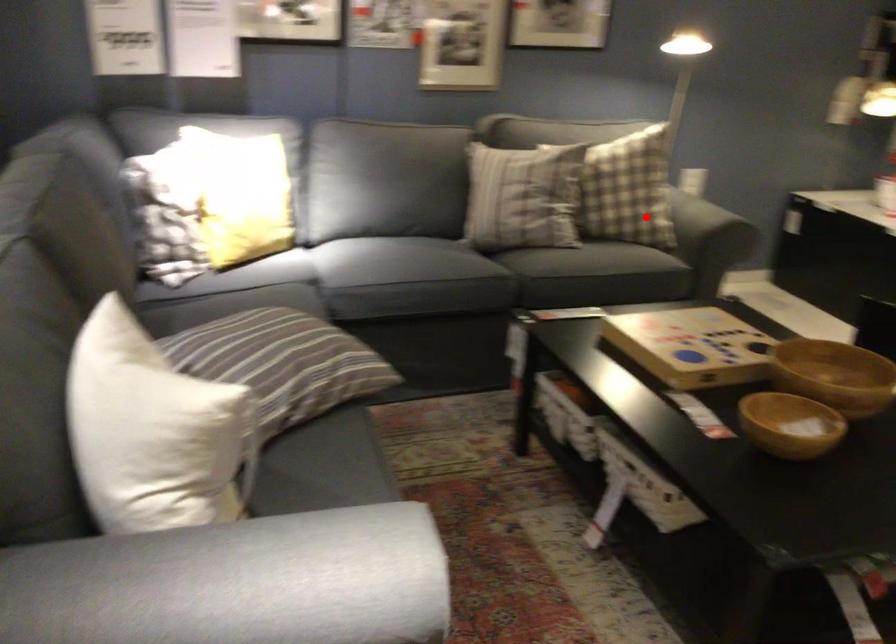
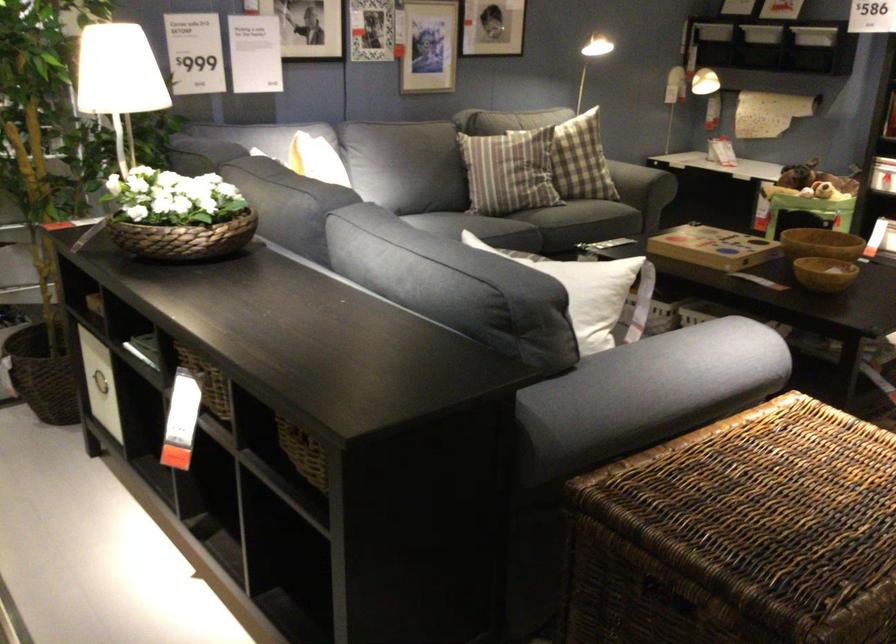
In the second image, find the point that corresponds to the highlighted location in the first image.

(633, 180)